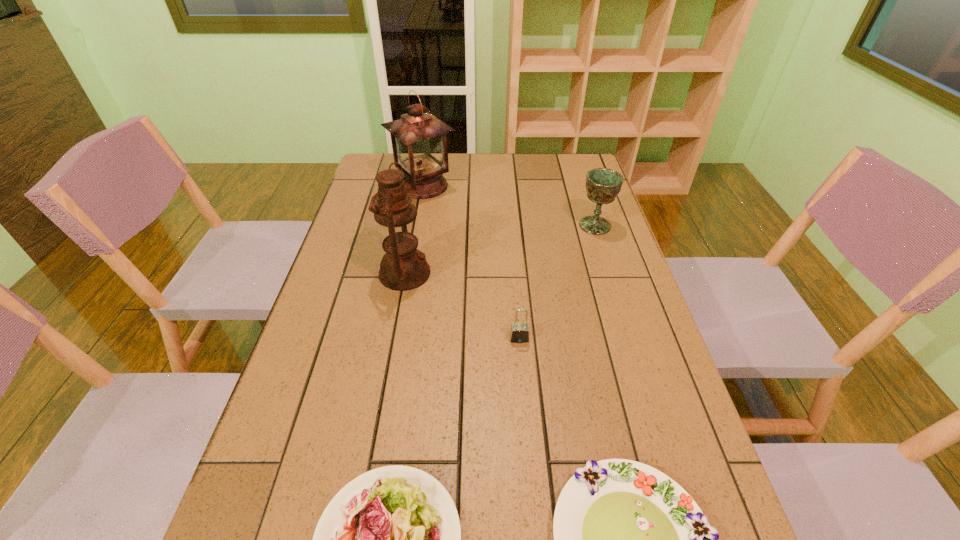
Find the location of a particular element. object identified as the fourth closest to the padlock is located at coordinates (603, 185).

Identify which object is the fourth nearest to the shorter salad plate. Please provide its 2D coordinates. Your answer should be formatted as a tuple, i.e. [(x, y)], where the tuple contains the x and y coordinates of a point satisfying the conditions above.

[(603, 185)]

Where is `vacant point that satisfies the following two spatial constraints: 1. on the back side of the nearer oil lamp; 2. on the left side of the farthest object`? Image resolution: width=960 pixels, height=540 pixels. vacant point that satisfies the following two spatial constraints: 1. on the back side of the nearer oil lamp; 2. on the left side of the farthest object is located at coordinates (420, 186).